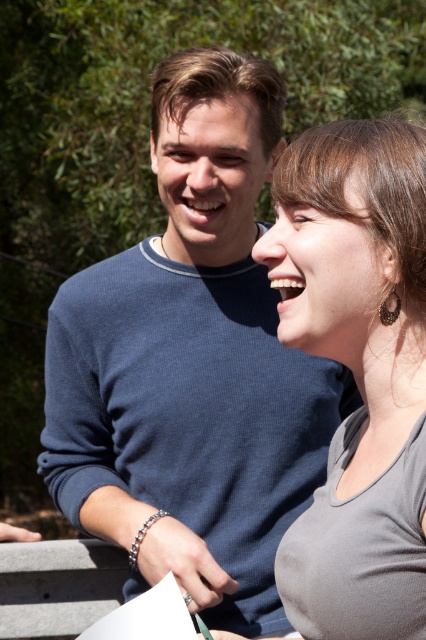
Based on the photo, you are a fashion designer observing two outfits in the image. The blue ribbed sweater at upper left and the gray matte tank top at right. Which one is taller?

The blue ribbed sweater at upper left is taller than the gray matte tank top at right.

You are trying to locate the blue ribbed sweater at upper left in the image. Can you tell me its coordinates?

The blue ribbed sweater at upper left is located at coordinates point (192,364).